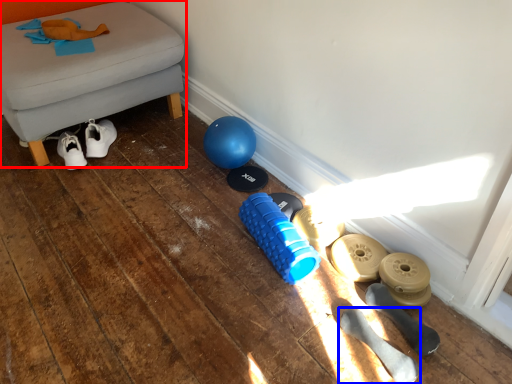
Question: Which object appears farthest to the camera in this image, furniture (highlighted by a red box) or footwear (highlighted by a blue box)?

Choices:
 (A) furniture
 (B) footwear

Answer: (A)